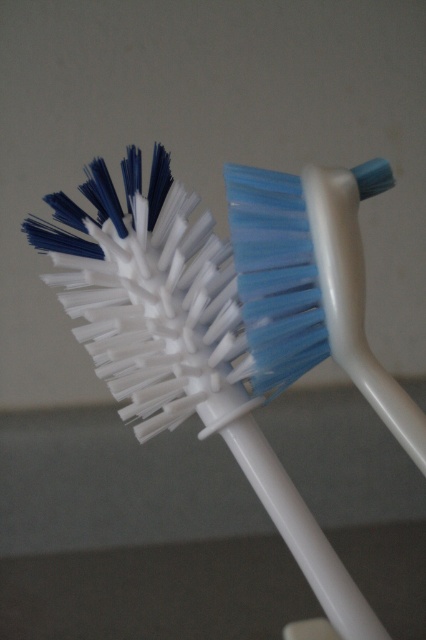
Question: Is white plastic toothbrush at center thinner than blue plastic toothbrush at center?

Choices:
 (A) yes
 (B) no

Answer: (B)

Question: Does white plastic toothbrush at center appear on the left side of blue plastic toothbrush at center?

Choices:
 (A) yes
 (B) no

Answer: (A)

Question: Which of the following is the farthest from the observer?

Choices:
 (A) blue plastic toothbrush at center
 (B) white plastic toothbrush at center

Answer: (B)

Question: Among these objects, which one is nearest to the camera?

Choices:
 (A) white plastic toothbrush at center
 (B) blue plastic toothbrush at center

Answer: (B)

Question: Can you confirm if white plastic toothbrush at center is wider than blue plastic toothbrush at center?

Choices:
 (A) no
 (B) yes

Answer: (B)